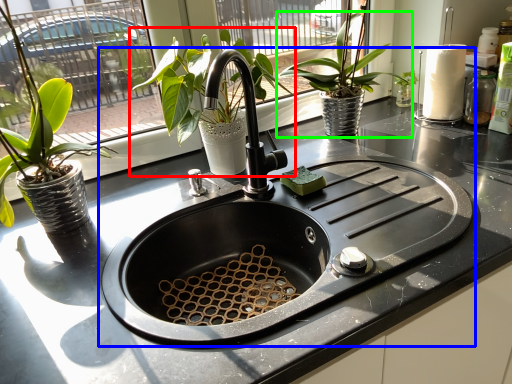
Question: Which object is the closest to the houseplant (highlighted by a red box)? Choose among these: sink (highlighted by a blue box) or houseplant (highlighted by a green box).

Choices:
 (A) sink
 (B) houseplant

Answer: (A)